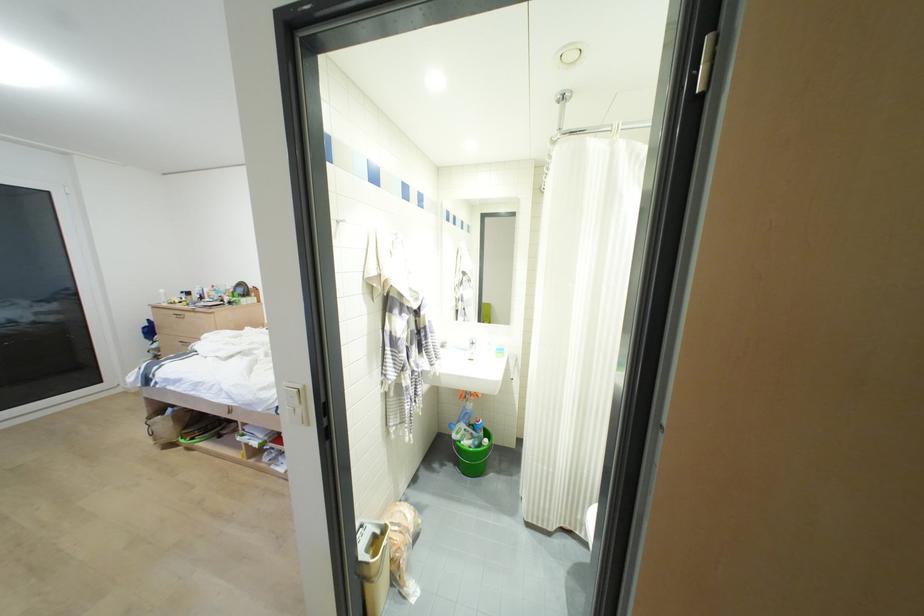
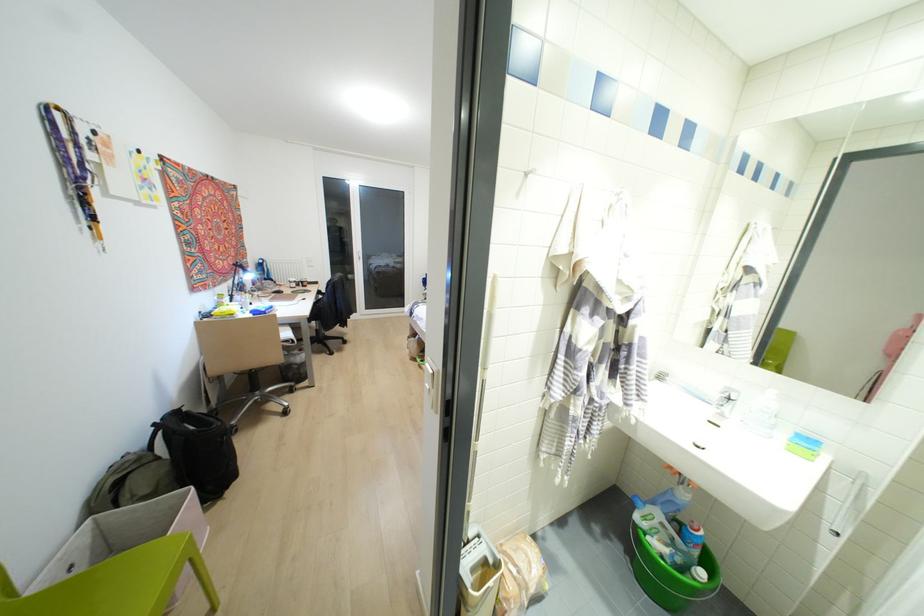
Locate, in the second image, the point that corresponds to the point at 372,570 in the first image.

(469, 600)